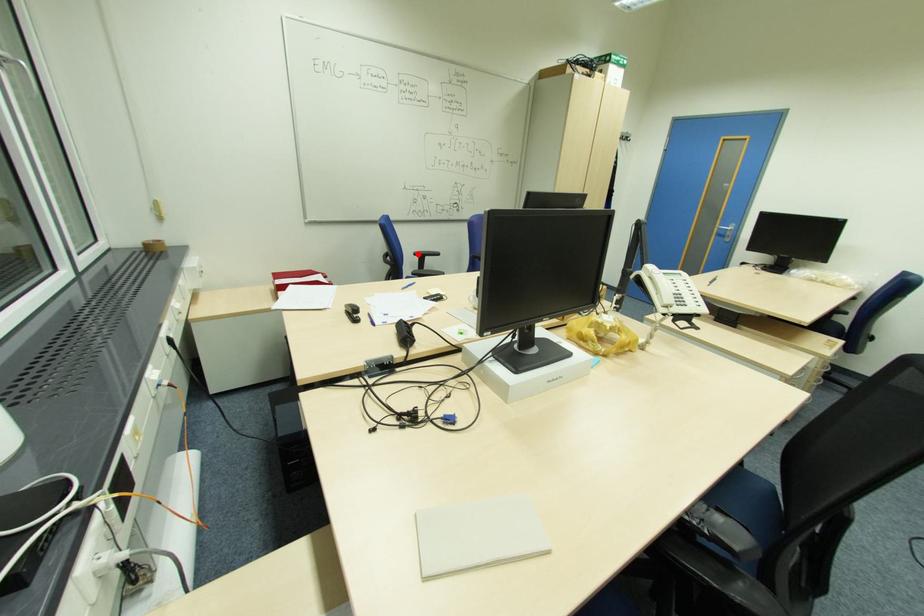
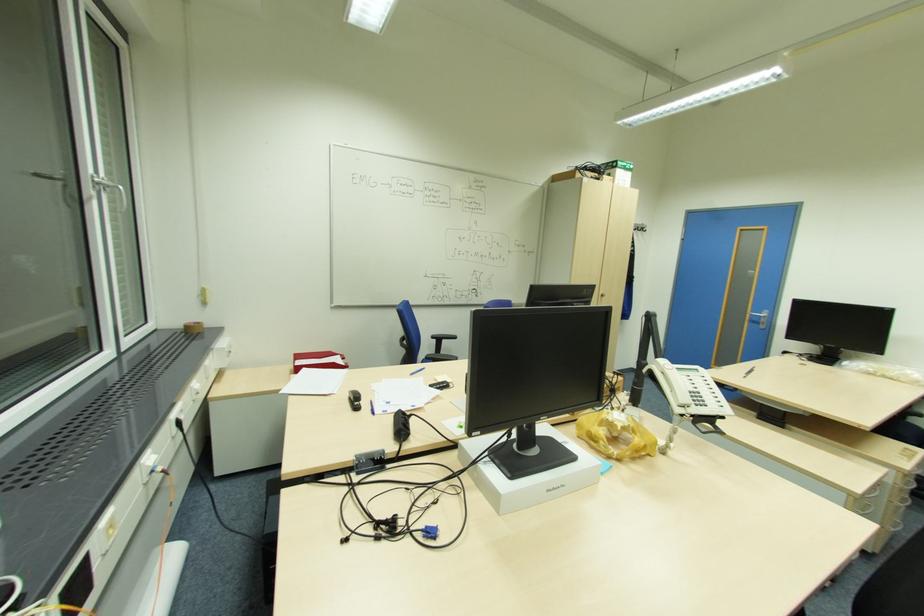
The point at the highlighted location is marked in the first image. Where is the corresponding point in the second image?

(435, 337)